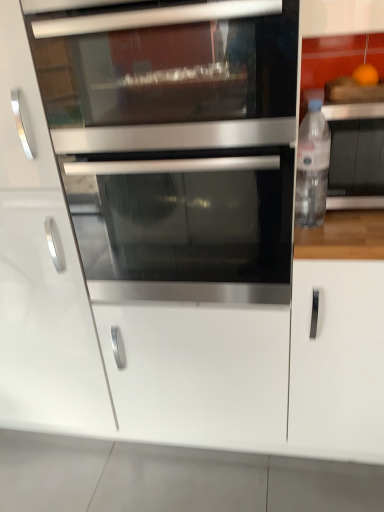
Question: Considering the relative sizes of white matte cabinet handle at right, marked as the second cabinetry in a left-to-right arrangement, and stainless steel microwave at center in the image provided, is white matte cabinet handle at right, marked as the second cabinetry in a left-to-right arrangement, smaller than stainless steel microwave at center?

Choices:
 (A) yes
 (B) no

Answer: (B)

Question: Can you confirm if white matte cabinet handle at right, marked as the second cabinetry in a left-to-right arrangement, is bigger than stainless steel microwave at center?

Choices:
 (A) yes
 (B) no

Answer: (A)

Question: Would you say white matte cabinet handle at right, marked as the second cabinetry in a left-to-right arrangement, is outside stainless steel microwave at center?

Choices:
 (A) no
 (B) yes

Answer: (B)

Question: Can you confirm if white matte cabinet handle at right, marked as the second cabinetry in a left-to-right arrangement, is taller than stainless steel microwave at center?

Choices:
 (A) yes
 (B) no

Answer: (A)

Question: Is white matte cabinet handle at right, which is the 1th cabinetry in right-to-left order, closer to camera compared to stainless steel microwave at center?

Choices:
 (A) no
 (B) yes

Answer: (A)

Question: Is white matte cabinet handle at right, which is the 1th cabinetry in right-to-left order, far from stainless steel microwave at center?

Choices:
 (A) yes
 (B) no

Answer: (B)

Question: Is stainless steel oven at center smaller than white glossy cabinet at center, placed as the first cabinetry when sorted from left to right?

Choices:
 (A) yes
 (B) no

Answer: (A)

Question: From the image's perspective, does stainless steel oven at center appear higher than white glossy cabinet at center, placed as the first cabinetry when sorted from left to right?

Choices:
 (A) no
 (B) yes

Answer: (B)

Question: Is stainless steel oven at center positioned with its back to white glossy cabinet at center, the second cabinetry in the right-to-left sequence?

Choices:
 (A) yes
 (B) no

Answer: (B)

Question: Does stainless steel oven at center appear on the left side of white glossy cabinet at center, the second cabinetry in the right-to-left sequence?

Choices:
 (A) no
 (B) yes

Answer: (A)

Question: Considering the relative sizes of stainless steel oven at center and white glossy cabinet at center, placed as the first cabinetry when sorted from left to right, in the image provided, is stainless steel oven at center taller than white glossy cabinet at center, placed as the first cabinetry when sorted from left to right,?

Choices:
 (A) no
 (B) yes

Answer: (A)

Question: Can you confirm if stainless steel oven at center is shorter than white glossy cabinet at center, placed as the first cabinetry when sorted from left to right?

Choices:
 (A) no
 (B) yes

Answer: (B)

Question: Can you confirm if white matte cabinet handle at right, marked as the second cabinetry in a left-to-right arrangement, is bigger than white matte drawer at center?

Choices:
 (A) yes
 (B) no

Answer: (A)